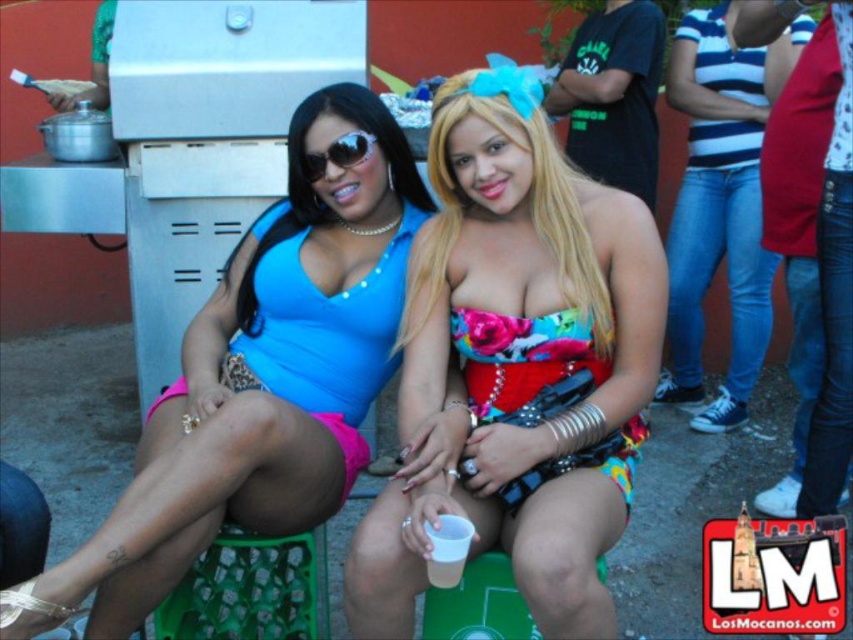
Question: Which object appears farthest from the camera in this image?

Choices:
 (A) matte blue dress at center
 (B) floral fabric dress at center
 (C) sunglasses at center
 (D) floral strapless dress at center

Answer: (C)

Question: Estimate the real-world distances between objects in this image. Which object is closer to the matte blue dress at center?

Choices:
 (A) floral fabric dress at center
 (B) floral strapless dress at center

Answer: (B)

Question: Can you confirm if floral strapless dress at center is thinner than floral fabric dress at center?

Choices:
 (A) yes
 (B) no

Answer: (B)

Question: Does floral strapless dress at center have a greater width compared to sunglasses at center?

Choices:
 (A) yes
 (B) no

Answer: (A)

Question: Is the position of floral fabric dress at center less distant than that of sunglasses at center?

Choices:
 (A) yes
 (B) no

Answer: (A)

Question: Among these points, which one is farthest from the camera?

Choices:
 (A) (184, 403)
 (B) (357, 154)

Answer: (B)